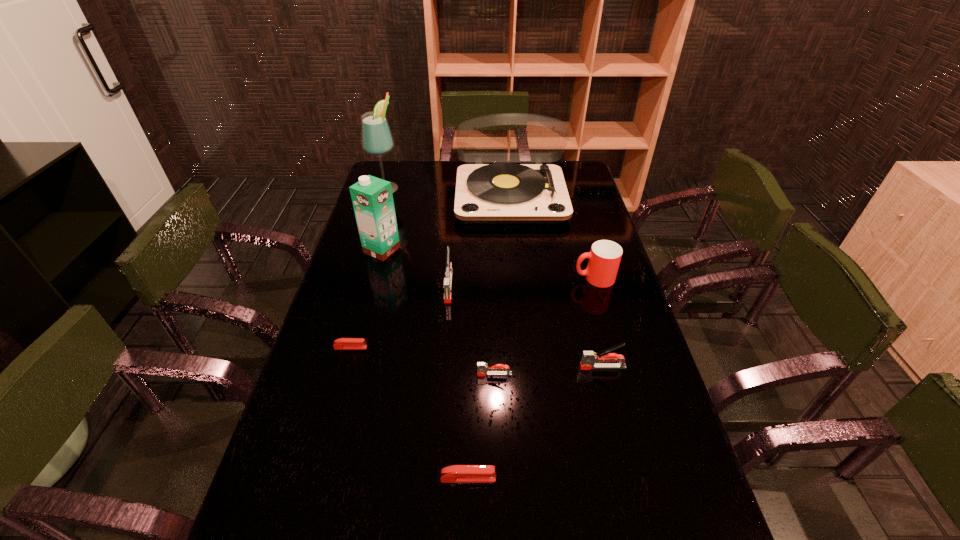
This screenshot has width=960, height=540. Find the location of `vacant space located 0.190m on the side of the red cup with the handle`. vacant space located 0.190m on the side of the red cup with the handle is located at coordinates (516, 278).

Locate an element on the screen. Image resolution: width=960 pixels, height=540 pixels. vacant space located 0.220m on the side of the red cup with the handle is located at coordinates (506, 278).

Locate an element on the screen. vacant area situated 0.240m on the handle side of the rightmost stapler is located at coordinates (490, 367).

Identify the location of free space located 0.350m on the handle side of the rightmost stapler. Image resolution: width=960 pixels, height=540 pixels. (448, 367).

Identify the location of vacant region located 0.290m on the handle side of the rightmost stapler. This screenshot has height=540, width=960. (471, 367).

The image size is (960, 540). In order to click on vacant space positioned on the handle side of the second nearest object in this screenshot , I will do `click(336, 374)`.

Locate an element on the screen. The image size is (960, 540). free point located on the handle side of the second nearest object is located at coordinates (332, 374).

This screenshot has width=960, height=540. In order to click on free space located 0.320m on the handle side of the second nearest object in this screenshot , I will do `click(355, 374)`.

You are a GUI agent. You are given a task and a screenshot of the screen. Output one action in this format:
    pyautogui.click(x=<x>, y=<y>)
    Task: Click on the vacant region located 0.060m on the front-facing side of the nearer red stapler
    
    Given the screenshot: What is the action you would take?
    pyautogui.click(x=523, y=478)

The image size is (960, 540). What are the coordinates of `free spot located 0.140m on the front-facing side of the fourth nearest object` in the screenshot? It's located at (418, 347).